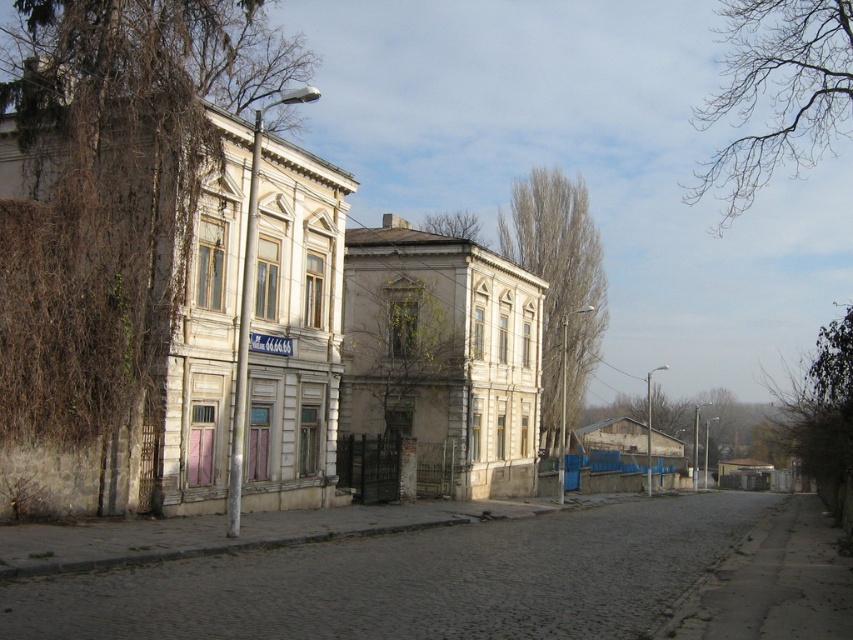
Question: Can you confirm if bare branches at upper right is bigger than brown textured tree at upper center?

Choices:
 (A) yes
 (B) no

Answer: (A)

Question: Which is farther from the bare branches at upper right?

Choices:
 (A) bare branches at upper center
 (B) green leafy tree at center
 (C) brown vine-covered wall at left
 (D) brown textured tree at upper center

Answer: (B)

Question: Among these objects, which one is nearest to the camera?

Choices:
 (A) green leafy tree at center
 (B) cobblestone street at lower left
 (C) bare branches at upper center
 (D) bare branches at upper right

Answer: (B)

Question: Which of the following is the farthest from the observer?

Choices:
 (A) brown textured tree at upper center
 (B) green leafy tree at center

Answer: (A)

Question: Does brown vine-covered wall at left lie behind bare branches at upper right?

Choices:
 (A) no
 (B) yes

Answer: (A)

Question: From the image, what is the correct spatial relationship of brown textured tree at upper center in relation to bare branches at upper center?

Choices:
 (A) right
 (B) left

Answer: (A)